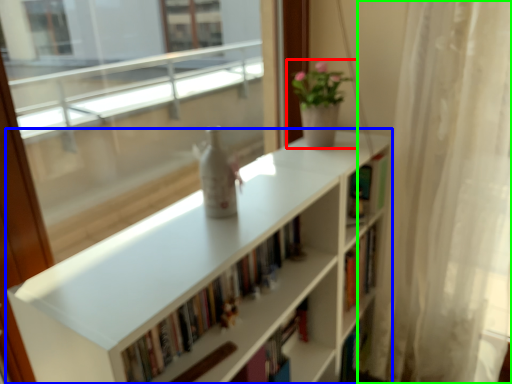
Question: Which is nearer to the houseplant (highlighted by a red box)? bookcase (highlighted by a blue box) or curtain (highlighted by a green box).

Choices:
 (A) bookcase
 (B) curtain

Answer: (A)